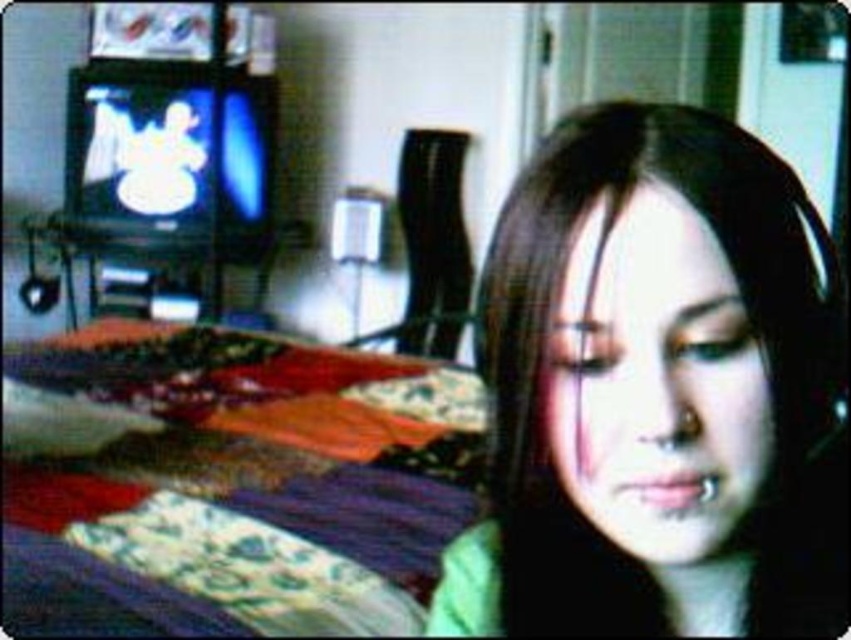
You are designing a layout for a photo shoot and need to ensure that the matte green shirt at center and the multicolored fabric bed at lower left are positioned appropriately. Based on their sizes, which object should be placed closer to the camera to maintain visual balance?

The matte green shirt at center is narrower than the multicolored fabric bed at lower left. To maintain visual balance, the matte green shirt at center should be placed closer to the camera since its smaller size can be visually balanced by proximity, while the larger bed can be positioned slightly farther back.

From the picture: You are an interior designer assessing the room layout. The matte green shirt at center and the multicolored fabric bed at lower left are both in the foreground. Which object is smaller in size?

The matte green shirt at center has a smaller size compared to the multicolored fabric bed at lower left, so the matte green shirt at center is smaller.

Looking at this image, you are a photographer trying to capture a closeup of the matte green shirt at center and the multicolored fabric bed at lower left. Since you can only focus on one object at a time, which object should you focus on first if you want to ensure both are in the frame without moving the camera?

You should focus on the matte green shirt at center first because it is positioned to the right of the multicolored fabric bed at lower left, so adjusting focus starting from the right ensures both objects remain within the frame.